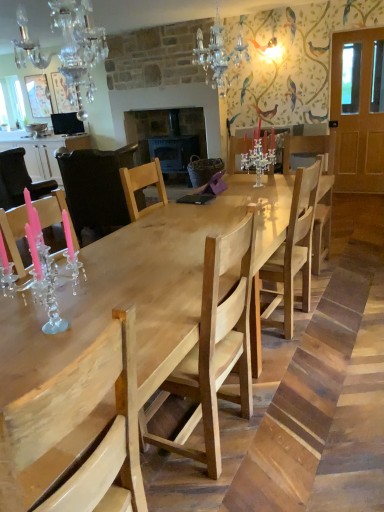
Find the location of a particular element. Image resolution: width=384 pixels, height=512 pixels. natural wood chair at center, marked as the 4th chair in a back-to-front arrangement is located at coordinates (294, 250).

You are a GUI agent. You are given a task and a screenshot of the screen. Output one action in this format:
    pyautogui.click(x=<x>, y=<y>)
    Task: Click on the natural wood chair at center, the 6th chair positioned from the back
    The width and height of the screenshot is (384, 512).
    Given the screenshot: What is the action you would take?
    pyautogui.click(x=77, y=432)

In order to click on light wood chair at center, placed as the 5th chair when sorted from back to front in this screenshot , I will do `click(217, 346)`.

At what (x,y) coordinates should I click in order to perform the action: click on natural wood chair at center, which is the 3th chair in front-to-back order. Please return your answer as a coordinate pair (x, y). The width and height of the screenshot is (384, 512). Looking at the image, I should click on (294, 250).

In terms of width, does light wood chair at center, placed as the 5th chair when sorted from back to front, look wider or thinner when compared to natural wood chair at center, the 6th chair positioned from the back?

In the image, light wood chair at center, placed as the 5th chair when sorted from back to front, appears to be more narrow than natural wood chair at center, the 6th chair positioned from the back.

Is natural wood chair at center, the 6th chair positioned from the back, a part of light wood chair at center, placed as the 2th chair when sorted from front to back?

No, natural wood chair at center, the 6th chair positioned from the back, is located outside of light wood chair at center, placed as the 2th chair when sorted from front to back.

In the image, is light wood chair at center, placed as the 5th chair when sorted from back to front, on the left side or the right side of natural wood chair at center, acting as the first chair starting from the front?

light wood chair at center, placed as the 5th chair when sorted from back to front, is positioned on natural wood chair at center, acting as the first chair starting from the front,'s right side.

Is point (240, 365) positioned before point (3, 417)?

No, (240, 365) is further to viewer.

Which is farther, (x=184, y=372) or (x=67, y=89)?

Positioned behind is point (x=67, y=89).

Considering the sizes of light wood chair at center, placed as the 5th chair when sorted from back to front, and crystal chandelier at upper left, arranged as the first light fixture when viewed from the front, in the image, is light wood chair at center, placed as the 5th chair when sorted from back to front, bigger or smaller than crystal chandelier at upper left, arranged as the first light fixture when viewed from the front,?

light wood chair at center, placed as the 5th chair when sorted from back to front, is bigger than crystal chandelier at upper left, arranged as the first light fixture when viewed from the front.

From a real-world perspective, count 1st light fixtures upward from the light wood chair at center, placed as the 2th chair when sorted from front to back, and point to it. Please provide its 2D coordinates.

[(67, 47)]

How different are the orientations of light wood chair at center, placed as the 2th chair when sorted from front to back, and crystal chandelier at upper left, which is the second light fixture from back to front, in degrees?

The angular difference between light wood chair at center, placed as the 2th chair when sorted from front to back, and crystal chandelier at upper left, which is the second light fixture from back to front, is 10.4 degrees.

From a real-world perspective, is pink glossy candlestick at left, which is the 1th chair in back-to-front order, below natural wood chair at center, the 6th chair positioned from the back?

No, from a real-world perspective, pink glossy candlestick at left, which is the 1th chair in back-to-front order, is not under natural wood chair at center, the 6th chair positioned from the back.

Which of these two, pink glossy candlestick at left, which ranks as the sixth chair in front-to-back order, or natural wood chair at center, acting as the first chair starting from the front, is bigger?

pink glossy candlestick at left, which ranks as the sixth chair in front-to-back order, is bigger.

Is pink glossy candlestick at left, which ranks as the sixth chair in front-to-back order, positioned with its back to natural wood chair at center, the 6th chair positioned from the back?

pink glossy candlestick at left, which ranks as the sixth chair in front-to-back order, does not have its back to natural wood chair at center, the 6th chair positioned from the back.

Would you consider crystal chandelier at upper center, placed as the 1th light fixture when sorted from right to left, to be distant from white glossy cabinet at left?

crystal chandelier at upper center, placed as the 1th light fixture when sorted from right to left, is positioned a significant distance from white glossy cabinet at left.

Based on the photo, does crystal chandelier at upper center, the 1th light fixture viewed from the back, appear on the right side of white glossy cabinet at left?

Indeed, crystal chandelier at upper center, the 1th light fixture viewed from the back, is positioned on the right side of white glossy cabinet at left.

Looking at their sizes, would you say crystal chandelier at upper center, placed as the 1th light fixture when sorted from right to left, is wider or thinner than white glossy cabinet at left?

crystal chandelier at upper center, placed as the 1th light fixture when sorted from right to left, is thinner than white glossy cabinet at left.

You are a GUI agent. You are given a task and a screenshot of the screen. Output one action in this format:
    pyautogui.click(x=<x>, y=<y>)
    Task: Click on the cabinetry on the left of crystal chandelier at upper center, the 1th light fixture viewed from the back
    Image resolution: width=384 pixels, height=512 pixels.
    Given the screenshot: What is the action you would take?
    pyautogui.click(x=43, y=151)

Considering the positions of objects light wood chair at center, placed as the 2th chair when sorted from front to back, and pink glossy candlestick at left, which is the 1th chair in back-to-front order, in the image provided, who is behind, light wood chair at center, placed as the 2th chair when sorted from front to back, or pink glossy candlestick at left, which is the 1th chair in back-to-front order,?

pink glossy candlestick at left, which is the 1th chair in back-to-front order, is more distant.

Can you tell me how much light wood chair at center, placed as the 5th chair when sorted from back to front, and pink glossy candlestick at left, which is the 1th chair in back-to-front order, differ in facing direction?

The facing directions of light wood chair at center, placed as the 5th chair when sorted from back to front, and pink glossy candlestick at left, which is the 1th chair in back-to-front order, are 99.1 degrees apart.

Is light wood chair at center, placed as the 5th chair when sorted from back to front, taller than pink glossy candlestick at left, which ranks as the sixth chair in front-to-back order?

Indeed, light wood chair at center, placed as the 5th chair when sorted from back to front, has a greater height compared to pink glossy candlestick at left, which ranks as the sixth chair in front-to-back order.

Is light wood chair at center, placed as the 2th chair when sorted from front to back, looking in the opposite direction of pink glossy candlestick at left, which ranks as the sixth chair in front-to-back order?

light wood chair at center, placed as the 2th chair when sorted from front to back, does not have its back to pink glossy candlestick at left, which ranks as the sixth chair in front-to-back order.

Is natural wood table at center oriented away from crystal chandelier at upper left, the 2th light fixture in the top-to-bottom sequence?

No, natural wood table at center is not facing the opposite direction of crystal chandelier at upper left, the 2th light fixture in the top-to-bottom sequence.

Considering the positions of points (141, 280) and (87, 93), is point (141, 280) farther from camera compared to point (87, 93)?

No, it is not.

Visually, is natural wood table at center positioned to the left or to the right of crystal chandelier at upper left, the 2th light fixture in the top-to-bottom sequence?

Based on their positions, natural wood table at center is located to the right of crystal chandelier at upper left, the 2th light fixture in the top-to-bottom sequence.

Image resolution: width=384 pixels, height=512 pixels. Identify the location of kitchen & dining room table located below the crystal chandelier at upper left, the 2th light fixture in the top-to-bottom sequence (from the image's perspective). (143, 289).

Can you confirm if crystal chandelier at upper left, the 1th light fixture positioned from the left, is positioned to the left of black leather chair at center, which appears as the 2th chair when viewed from the back?

No.

Is crystal chandelier at upper left, the 1th light fixture positioned from the bottom, surrounding black leather chair at center, which appears as the 2th chair when viewed from the back?

That's incorrect, black leather chair at center, which appears as the 2th chair when viewed from the back, is not inside crystal chandelier at upper left, the 1th light fixture positioned from the bottom.

Is crystal chandelier at upper left, which is the second light fixture from back to front, far away from black leather chair at center, arranged as the fifth chair when viewed from the front?

Absolutely, crystal chandelier at upper left, which is the second light fixture from back to front, is distant from black leather chair at center, arranged as the fifth chair when viewed from the front.

In terms of size, does crystal chandelier at upper left, which is the second light fixture from back to front, appear bigger or smaller than black leather chair at center, arranged as the fifth chair when viewed from the front?

crystal chandelier at upper left, which is the second light fixture from back to front, is smaller than black leather chair at center, arranged as the fifth chair when viewed from the front.

From the natural wood chair at center, acting as the first chair starting from the front, count 1st chair to the right and point to it. Please provide its 2D coordinates.

[(217, 346)]

Locate an element on the screen. Image resolution: width=384 pixels, height=512 pixels. light fixture in front of the light wood chair at center, placed as the 2th chair when sorted from front to back is located at coordinates tap(67, 47).

Which object lies further to the anchor point black leather chair at center, arranged as the fifth chair when viewed from the front, clear crystal candelabra at center, which is counted as the third chair, starting from the back, or natural wood chair at center, which is the 3th chair in front-to-back order?

The object further to black leather chair at center, arranged as the fifth chair when viewed from the front, is natural wood chair at center, which is the 3th chair in front-to-back order.

From the image, which object appears to be farther from white glossy cabinet at left, crystal chandelier at upper center, which ranks as the 1th light fixture in top-to-bottom order, or crystal chandelier at upper left, the 2th light fixture in the top-to-bottom sequence?

Based on the image, crystal chandelier at upper center, which ranks as the 1th light fixture in top-to-bottom order, appears to be further to white glossy cabinet at left.

From the image, which object appears to be farther from crystal chandelier at upper left, the 1th light fixture positioned from the left, natural wood table at center or white glossy cabinet at left?

white glossy cabinet at left lies further to crystal chandelier at upper left, the 1th light fixture positioned from the left, than the other object.

From the image, which object appears to be nearer to crystal chandelier at upper left, arranged as the 2th light fixture when viewed from the right, pink glossy candlestick at left, which is the 1th chair in back-to-front order, or light wood chair at center, placed as the 2th chair when sorted from front to back?

Among the two, pink glossy candlestick at left, which is the 1th chair in back-to-front order, is located nearer to crystal chandelier at upper left, arranged as the 2th light fixture when viewed from the right.

Considering their positions, is crystal chandelier at upper center, which ranks as the 1th light fixture in top-to-bottom order, positioned further to natural wood chair at center, marked as the 4th chair in a back-to-front arrangement, than black leather chair at center, arranged as the fifth chair when viewed from the front?

Among the two, black leather chair at center, arranged as the fifth chair when viewed from the front, is located further to natural wood chair at center, marked as the 4th chair in a back-to-front arrangement.

When comparing their distances from crystal chandelier at upper center, the 1th light fixture viewed from the back, does black leather chair at center, arranged as the fifth chair when viewed from the front, or natural wood table at center seem further?

The object further to crystal chandelier at upper center, the 1th light fixture viewed from the back, is black leather chair at center, arranged as the fifth chair when viewed from the front.

Looking at the image, which one is located further to natural wood chair at center, marked as the 4th chair in a back-to-front arrangement, black leather chair at center, which appears as the 2th chair when viewed from the back, or light wood chair at center, placed as the 2th chair when sorted from front to back?

The object further to natural wood chair at center, marked as the 4th chair in a back-to-front arrangement, is black leather chair at center, which appears as the 2th chair when viewed from the back.

Estimate the real-world distances between objects in this image. Which object is further from crystal chandelier at upper center, the 2th light fixture ordered from the bottom, crystal chandelier at upper left, the 2th light fixture in the top-to-bottom sequence, or clear crystal candelabra at center, placed as the fourth chair when sorted from front to back?

The object further to crystal chandelier at upper center, the 2th light fixture ordered from the bottom, is crystal chandelier at upper left, the 2th light fixture in the top-to-bottom sequence.

Image resolution: width=384 pixels, height=512 pixels. Identify the location of chair located between natural wood chair at center, the 6th chair positioned from the back, and natural wood chair at center, which is the 3th chair in front-to-back order, in the depth direction. (217, 346).

The image size is (384, 512). What are the coordinates of `kitchen & dining room table between natural wood chair at center, acting as the first chair starting from the front, and clear crystal candelabra at center, placed as the fourth chair when sorted from front to back, from front to back` in the screenshot? It's located at (143, 289).

Where is `light fixture between light wood chair at center, placed as the 2th chair when sorted from front to back, and black leather chair at center, which appears as the 2th chair when viewed from the back, from front to back`? light fixture between light wood chair at center, placed as the 2th chair when sorted from front to back, and black leather chair at center, which appears as the 2th chair when viewed from the back, from front to back is located at coordinates (218, 56).

Locate an element on the screen. This screenshot has width=384, height=512. light fixture between crystal chandelier at upper center, which ranks as the 1th light fixture in top-to-bottom order, and natural wood table at center vertically is located at coordinates (67, 47).